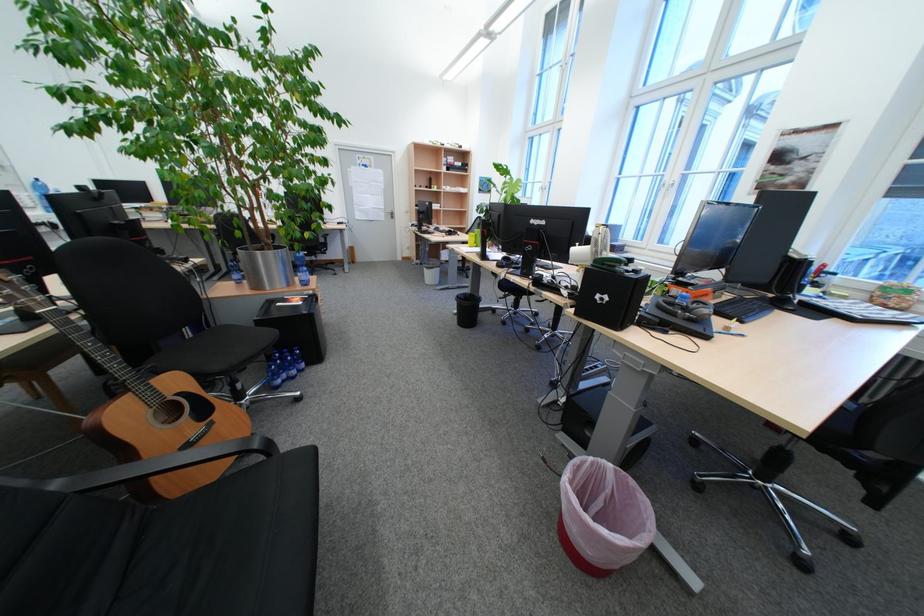
Identify the location of black leather sitting surface. (232, 546).